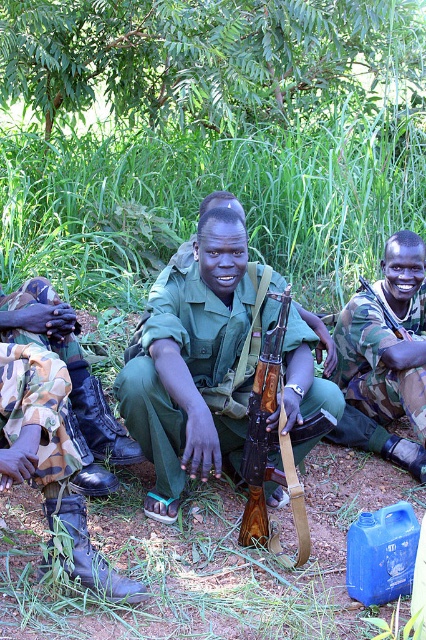
Which is more to the left, green matte uniform at center or black leather boots at lower left?

Positioned to the left is black leather boots at lower left.

Is green matte uniform at center to the left of black leather boots at lower left from the viewer's perspective?

Incorrect, green matte uniform at center is not on the left side of black leather boots at lower left.

Where is `green matte uniform at center`? The image size is (426, 640). green matte uniform at center is located at coordinates (192, 369).

Between black leather boots at lower left and wooden rifle at center, which one is positioned higher?

Positioned higher is wooden rifle at center.

Looking at this image, who is positioned more to the left, black leather boots at lower left or wooden rifle at center?

black leather boots at lower left

Between point (71, 573) and point (267, 525), which one is positioned behind?

The point (267, 525) is behind.

Image resolution: width=426 pixels, height=640 pixels. I want to click on black leather boots at lower left, so click(x=49, y=456).

Can you confirm if camouflage fabric uniform at lower right is taller than wooden rifle at center?

Incorrect, camouflage fabric uniform at lower right's height is not larger of wooden rifle at center's.

Does point (370, 310) come in front of point (271, 378)?

No, (370, 310) is behind (271, 378).

The height and width of the screenshot is (640, 426). I want to click on camouflage fabric uniform at lower right, so click(380, 358).